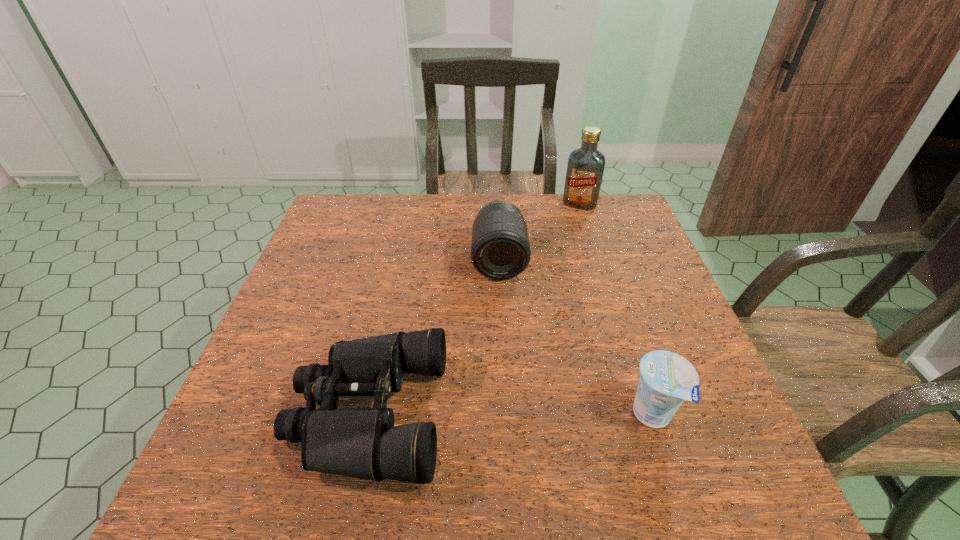
I want to click on free space on the desktop that is between the shortest object and the second shortest object and is positioned on the surface of the second tallest object, so click(x=505, y=414).

I want to click on free space on the desktop that is between the leftmost object and the yogurt and is positioned on the front-facing side of the vodka, so click(x=483, y=414).